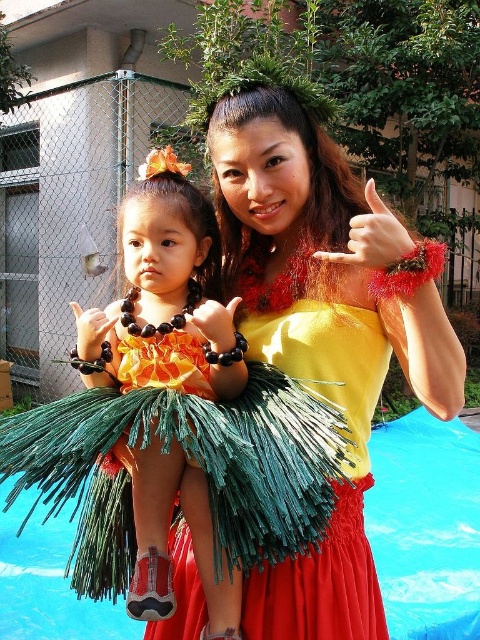
Is yellow satin dress at center bigger than orange fabric dress at center?

Yes.

Is yellow satin dress at center to the right of orange fabric dress at center from the viewer's perspective?

Yes, yellow satin dress at center is to the right of orange fabric dress at center.

Between point (277, 358) and point (154, 586), which one is positioned in front?

Point (154, 586) is more forward.

This screenshot has width=480, height=640. What are the coordinates of `yellow satin dress at center` in the screenshot? It's located at (324, 326).

Which of these two, orange fabric dress at center or blue plastic pool at center, stands taller?

With more height is orange fabric dress at center.

Can you confirm if orange fabric dress at center is smaller than blue plastic pool at center?

Yes.

Between point (165, 321) and point (416, 548), which one is positioned behind?

The point (416, 548) is more distant.

Where is `orange fabric dress at center`? orange fabric dress at center is located at coordinates (165, 296).

How distant is yellow satin dress at center from blue plastic pool at center?

They are 6.63 feet apart.

Between yellow satin dress at center and blue plastic pool at center, which one appears on the left side from the viewer's perspective?

From the viewer's perspective, yellow satin dress at center appears more on the left side.

The width and height of the screenshot is (480, 640). Describe the element at coordinates (324, 326) in the screenshot. I see `yellow satin dress at center` at that location.

This screenshot has width=480, height=640. I want to click on yellow satin dress at center, so click(x=324, y=326).